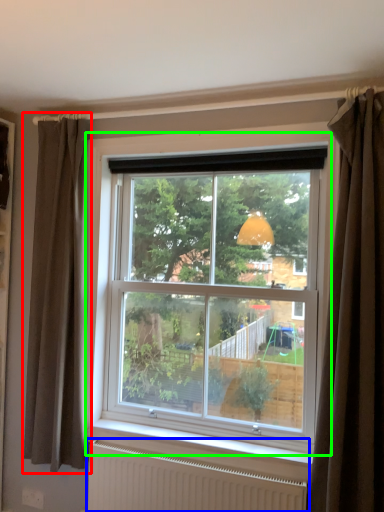
Question: Estimate the real-world distances between objects in this image. Which object is closer to curtain (highlighted by a red box), radiator (highlighted by a blue box) or window (highlighted by a green box)?

Choices:
 (A) radiator
 (B) window

Answer: (B)